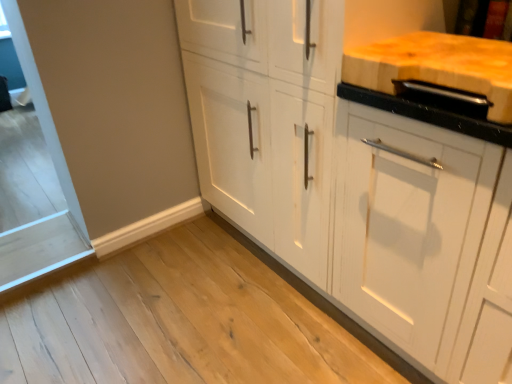
The width and height of the screenshot is (512, 384). What do you see at coordinates (343, 181) in the screenshot?
I see `white matte cabinet at center` at bounding box center [343, 181].

The image size is (512, 384). In order to click on white matte cabinet at center in this screenshot , I will do `click(343, 181)`.

You are a GUI agent. You are given a task and a screenshot of the screen. Output one action in this format:
    pyautogui.click(x=<x>, y=<y>)
    Task: Click on the natural wood cutting board at upper right
    
    Given the screenshot: What is the action you would take?
    pyautogui.click(x=432, y=80)

The image size is (512, 384). Describe the element at coordinates (432, 80) in the screenshot. I see `natural wood cutting board at upper right` at that location.

Measure the distance between point (x=388, y=57) and camera.

Point (x=388, y=57) and camera are 3.36 feet apart from each other.

This screenshot has width=512, height=384. I want to click on white matte cabinet at center, so click(343, 181).

Considering the positions of objects natural wood cutting board at upper right and white matte cabinet at center in the image provided, who is more to the right, natural wood cutting board at upper right or white matte cabinet at center?

Positioned to the right is natural wood cutting board at upper right.

Is natural wood cutting board at upper right positioned behind white matte cabinet at center?

No, it is in front of white matte cabinet at center.

Considering the positions of points (426, 35) and (434, 256), is point (426, 35) farther from camera compared to point (434, 256)?

Yes, it is.

From the image's perspective, which one is positioned higher, natural wood cutting board at upper right or white matte cabinet at center?

natural wood cutting board at upper right, from the image's perspective.

From a real-world perspective, relative to white matte cabinet at center, is natural wood cutting board at upper right vertically above or below?

In terms of real-world spatial position, natural wood cutting board at upper right is above white matte cabinet at center.

Between natural wood cutting board at upper right and white matte cabinet at center, which one has larger width?

With larger width is white matte cabinet at center.

Between natural wood cutting board at upper right and white matte cabinet at center, which one has more height?

Standing taller between the two is white matte cabinet at center.

Who is bigger, natural wood cutting board at upper right or white matte cabinet at center?

white matte cabinet at center.

Is natural wood cutting board at upper right not within white matte cabinet at center?

natural wood cutting board at upper right lies outside white matte cabinet at center's area.

Are natural wood cutting board at upper right and white matte cabinet at center beside each other?

No, natural wood cutting board at upper right is not next to white matte cabinet at center.

Is natural wood cutting board at upper right looking in the opposite direction of white matte cabinet at center?

natural wood cutting board at upper right does not have its back to white matte cabinet at center.

How far apart are natural wood cutting board at upper right and white matte cabinet at center?

natural wood cutting board at upper right is 11.01 inches away from white matte cabinet at center.

You are a GUI agent. You are given a task and a screenshot of the screen. Output one action in this format:
    pyautogui.click(x=<x>, y=<y>)
    Task: Click on the countertop above the white matte cabinet at center (from a real-world perspective)
    
    Given the screenshot: What is the action you would take?
    pyautogui.click(x=432, y=80)

Is white matte cabinet at center to the right of natural wood cutting board at upper right from the viewer's perspective?

No, white matte cabinet at center is not to the right of natural wood cutting board at upper right.

In the image, is white matte cabinet at center positioned in front of or behind natural wood cutting board at upper right?

Clearly, white matte cabinet at center is behind natural wood cutting board at upper right.

Which is behind, point (457, 373) or point (349, 63)?

The point (457, 373) is farther.

From the image's perspective, is white matte cabinet at center located above or below natural wood cutting board at upper right?

white matte cabinet at center is below natural wood cutting board at upper right.

From a real-world perspective, who is located higher, white matte cabinet at center or natural wood cutting board at upper right?

natural wood cutting board at upper right, from a real-world perspective.

Considering the relative sizes of white matte cabinet at center and natural wood cutting board at upper right in the image provided, is white matte cabinet at center thinner than natural wood cutting board at upper right?

No, white matte cabinet at center is not thinner than natural wood cutting board at upper right.

Which of these two, white matte cabinet at center or natural wood cutting board at upper right, stands shorter?

natural wood cutting board at upper right is shorter.

Does white matte cabinet at center have a larger size compared to natural wood cutting board at upper right?

Yes, white matte cabinet at center is bigger than natural wood cutting board at upper right.

Do you think white matte cabinet at center is within natural wood cutting board at upper right, or outside of it?

white matte cabinet at center lies outside natural wood cutting board at upper right.

Would you say white matte cabinet at center is a long distance from natural wood cutting board at upper right?

No, there isn't a large distance between white matte cabinet at center and natural wood cutting board at upper right.

Is white matte cabinet at center aimed at natural wood cutting board at upper right?

No.

How many degrees apart are the facing directions of white matte cabinet at center and natural wood cutting board at upper right?

white matte cabinet at center and natural wood cutting board at upper right are facing 0.512 degrees away from each other.

Measure the distance between white matte cabinet at center and natural wood cutting board at upper right.

white matte cabinet at center is 11.01 inches away from natural wood cutting board at upper right.

Find the location of a particular element. The image size is (512, 384). countertop that is on the right side of white matte cabinet at center is located at coordinates (432, 80).

The image size is (512, 384). What are the coordinates of `cabinetry located behind the natural wood cutting board at upper right` in the screenshot? It's located at (343, 181).

Find the location of `cabinetry below the natural wood cutting board at upper right (from the image's perspective)`. cabinetry below the natural wood cutting board at upper right (from the image's perspective) is located at coordinates (343, 181).